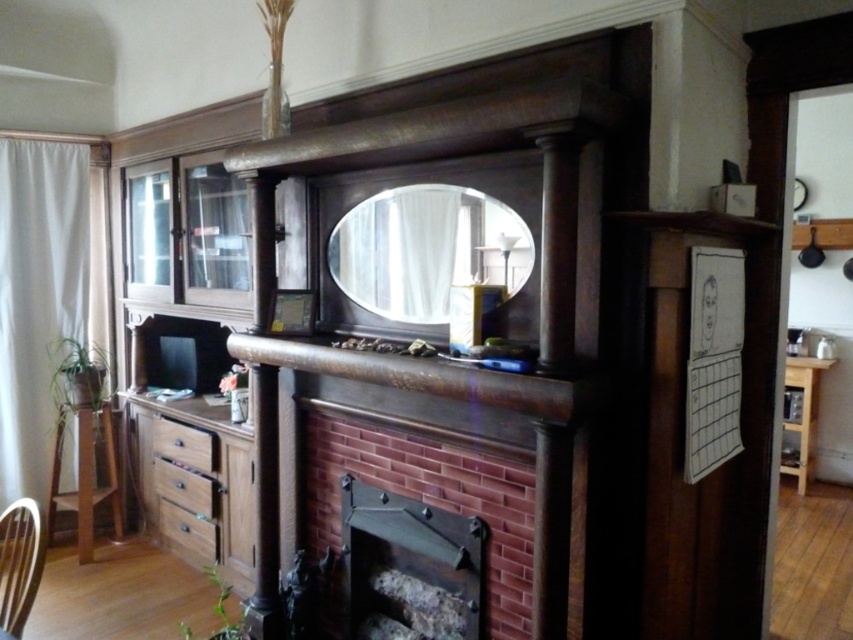
Question: Among these objects, which one is nearest to the camera?

Choices:
 (A) dark wood fireplace at center
 (B) clear glass mirror at center
 (C) wooden stool at lower left

Answer: (A)

Question: Which object appears farthest from the camera in this image?

Choices:
 (A) wooden drawer at lower center
 (B) brick fireplace at center

Answer: (A)

Question: In this image, where is clear glass mirror at center located relative to wooden drawer at lower left?

Choices:
 (A) below
 (B) above

Answer: (B)

Question: Is brick fireplace at center positioned behind brown wood drawer at lower left?

Choices:
 (A) no
 (B) yes

Answer: (A)

Question: Estimate the real-world distances between objects in this image. Which object is farther from the wooden drawer at lower left?

Choices:
 (A) wooden slatted chair at lower left
 (B) clear glass mirror at center
 (C) brown wood drawer at lower left
 (D) dark wood fireplace at center

Answer: (B)

Question: Is dark wood fireplace at center to the right of wooden stool at lower left from the viewer's perspective?

Choices:
 (A) yes
 (B) no

Answer: (A)